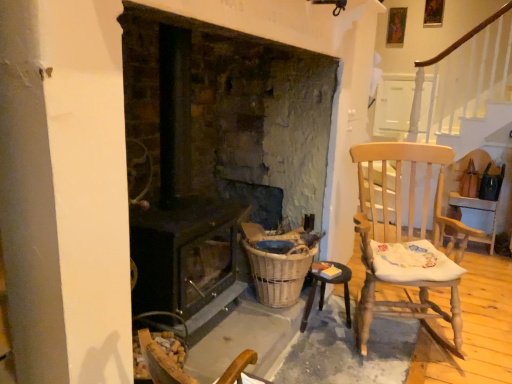
Identify the location of dark brown wood stove at center. This screenshot has width=512, height=384. (215, 148).

Locate an element on the screen. light wood rocking chair at right is located at coordinates (406, 238).

Describe the element at coordinates (278, 269) in the screenshot. I see `woven brown basket at lower center` at that location.

What do you see at coordinates (324, 292) in the screenshot? I see `wooden table at lower right` at bounding box center [324, 292].

Locate an element on the screen. The image size is (512, 384). dark brown wood stove at center is located at coordinates (215, 148).

Can you see woven brown basket at lower center touching light wood rocking chair at right?

No, woven brown basket at lower center is not touching light wood rocking chair at right.

Can we say woven brown basket at lower center lies outside light wood rocking chair at right?

Yes.

Is woven brown basket at lower center at the right side of light wood rocking chair at right?

Incorrect, woven brown basket at lower center is not on the right side of light wood rocking chair at right.

The width and height of the screenshot is (512, 384). In the image, there is a woven brown basket at lower center. What are the coordinates of `chair above it (from the image's perspective)` in the screenshot? It's located at (406, 238).

Would you say dark brown wood stove at center is a long distance from light wood rocking chair at right?

No, dark brown wood stove at center is not far away from light wood rocking chair at right.

Considering the sizes of dark brown wood stove at center and light wood rocking chair at right in the image, is dark brown wood stove at center taller or shorter than light wood rocking chair at right?

Considering their sizes, dark brown wood stove at center has more height than light wood rocking chair at right.

Consider the image. Between dark brown wood stove at center and light wood rocking chair at right, which one is positioned behind?

light wood rocking chair at right is behind.

In the scene shown: Is dark brown wood stove at center positioned beyond the bounds of light wood rocking chair at right?

Yes, dark brown wood stove at center is outside of light wood rocking chair at right.

Considering the relative sizes of light wood rocking chair at right and woven brown basket at lower center in the image provided, is light wood rocking chair at right smaller than woven brown basket at lower center?

No.

Consider the image. Which of these two, light wood rocking chair at right or woven brown basket at lower center, is wider?

Wider between the two is light wood rocking chair at right.

Is light wood rocking chair at right facing towards woven brown basket at lower center?

No, light wood rocking chair at right is not facing towards woven brown basket at lower center.

Considering the positions of objects dark brown wood stove at center and woven brown basket at lower center in the image provided, who is more to the left, dark brown wood stove at center or woven brown basket at lower center?

dark brown wood stove at center is more to the left.

Is dark brown wood stove at center looking in the opposite direction of woven brown basket at lower center?

dark brown wood stove at center does not have its back to woven brown basket at lower center.

Identify the location of basket behind the dark brown wood stove at center. The width and height of the screenshot is (512, 384). (278, 269).

Considering their positions, is dark brown wood stove at center located in front of or behind woven brown basket at lower center?

Clearly, dark brown wood stove at center is in front of woven brown basket at lower center.

Are wooden table at lower right and light wood rocking chair at right beside each other?

No, wooden table at lower right is not next to light wood rocking chair at right.

Is wooden table at lower right looking in the opposite direction of light wood rocking chair at right?

Yes, wooden table at lower right's orientation is away from light wood rocking chair at right.

Does point (346, 305) lie in front of point (359, 337)?

No.

From the image's perspective, is wooden table at lower right below light wood rocking chair at right?

Correct, wooden table at lower right appears lower than light wood rocking chair at right in the image.

In the scene shown: From the image's perspective, between wooden table at lower right and woven brown basket at lower center, which one is located above?

woven brown basket at lower center appears higher in the image.

The image size is (512, 384). Find the location of `table on the right of woven brown basket at lower center`. table on the right of woven brown basket at lower center is located at coordinates (324, 292).

From a real-world perspective, is wooden table at lower right on woven brown basket at lower center?

Actually, wooden table at lower right is physically below woven brown basket at lower center in the real world.

Is wooden table at lower right beside dark brown wood stove at center?

No.

Find the location of a particular element. fireplace above the wooden table at lower right (from the image's perspective) is located at coordinates (215, 148).

Consider the image. From a real-world perspective, is wooden table at lower right positioned over dark brown wood stove at center based on gravity?

No, from a real-world perspective, wooden table at lower right is not on top of dark brown wood stove at center.

Identify the location of basket behind the light wood rocking chair at right. (278, 269).

In order to click on fireplace above the light wood rocking chair at right (from a real-world perspective) in this screenshot , I will do click(x=215, y=148).

Based on their spatial positions, is dark brown wood stove at center or wooden table at lower right further from woven brown basket at lower center?

Among the two, dark brown wood stove at center is located further to woven brown basket at lower center.

From the image, which object appears to be farther from woven brown basket at lower center, wooden table at lower right or dark brown wood stove at center?

dark brown wood stove at center is further to woven brown basket at lower center.

Which object lies further to the anchor point woven brown basket at lower center, light wood rocking chair at right or dark brown wood stove at center?

dark brown wood stove at center lies further to woven brown basket at lower center than the other object.

Consider the image. Looking at the image, which one is located further to dark brown wood stove at center, woven brown basket at lower center or wooden table at lower right?

Among the two, wooden table at lower right is located further to dark brown wood stove at center.

Which object lies nearer to the anchor point dark brown wood stove at center, wooden table at lower right or light wood rocking chair at right?

light wood rocking chair at right is positioned closer to the anchor dark brown wood stove at center.

Looking at the image, which one is located further to wooden table at lower right, light wood rocking chair at right or woven brown basket at lower center?

The object further to wooden table at lower right is light wood rocking chair at right.

In the scene shown: Looking at the image, which one is located closer to wooden table at lower right, woven brown basket at lower center or dark brown wood stove at center?

woven brown basket at lower center is positioned closer to the anchor wooden table at lower right.

Which object lies further to the anchor point light wood rocking chair at right, wooden table at lower right or dark brown wood stove at center?

dark brown wood stove at center is positioned further to the anchor light wood rocking chair at right.

Identify the location of table between dark brown wood stove at center and light wood rocking chair at right in the horizontal direction. This screenshot has height=384, width=512. (324, 292).

You are a GUI agent. You are given a task and a screenshot of the screen. Output one action in this format:
    pyautogui.click(x=<x>, y=<y>)
    Task: Click on the basket located between dark brown wood stove at center and light wood rocking chair at right in the left-right direction
    The image size is (512, 384).
    Given the screenshot: What is the action you would take?
    pyautogui.click(x=278, y=269)

Locate an element on the screen. The width and height of the screenshot is (512, 384). basket positioned between dark brown wood stove at center and wooden table at lower right from near to far is located at coordinates (278, 269).

The image size is (512, 384). Find the location of `table situated between woven brown basket at lower center and light wood rocking chair at right from left to right`. table situated between woven brown basket at lower center and light wood rocking chair at right from left to right is located at coordinates pos(324,292).